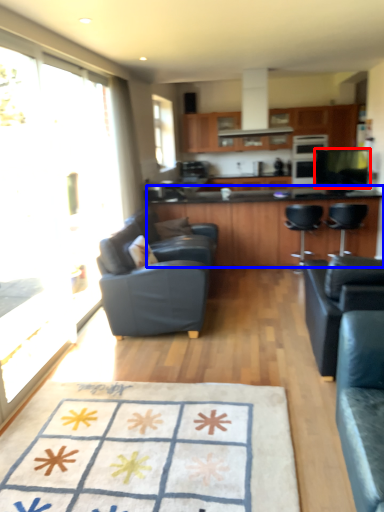
Question: Which object is further to the camera taking this photo, appliance (highlighted by a red box) or countertop (highlighted by a blue box)?

Choices:
 (A) appliance
 (B) countertop

Answer: (A)